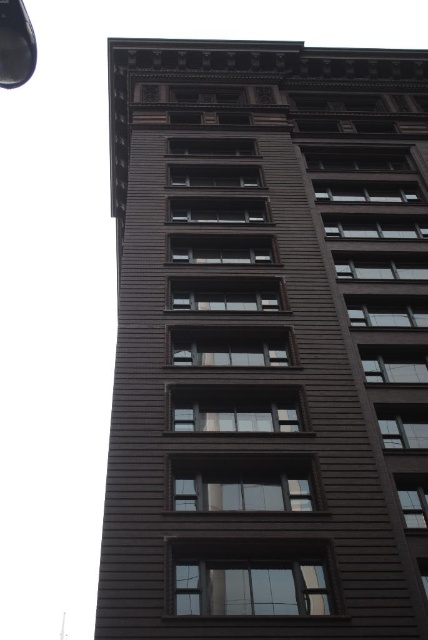
Question: Is brown wood grain building at center bigger than shiny black lamp post at upper left?

Choices:
 (A) yes
 (B) no

Answer: (A)

Question: From the image, what is the correct spatial relationship of brown wood grain building at center in relation to shiny black lamp post at upper left?

Choices:
 (A) below
 (B) above

Answer: (B)

Question: Which point is closer to the camera?

Choices:
 (A) shiny black lamp post at upper left
 (B) brown wood grain building at center

Answer: (A)

Question: Among these objects, which one is nearest to the camera?

Choices:
 (A) shiny black lamp post at upper left
 (B) brown wood grain building at center

Answer: (A)

Question: Does brown wood grain building at center appear on the left side of shiny black lamp post at upper left?

Choices:
 (A) yes
 (B) no

Answer: (B)